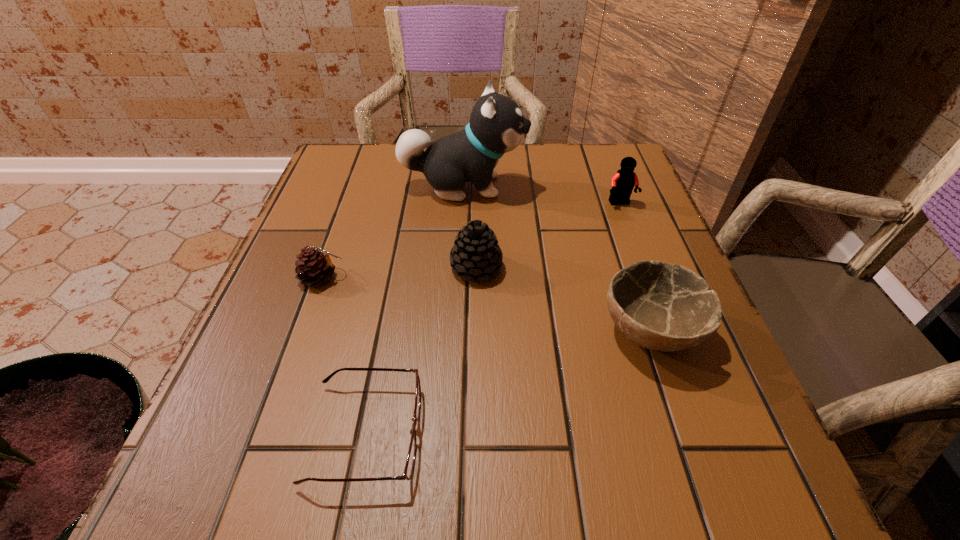
Identify the location of bowl that is positioned at the right edge. (659, 306).

Where is `object at the near left corner`? Image resolution: width=960 pixels, height=540 pixels. object at the near left corner is located at coordinates (410, 461).

This screenshot has width=960, height=540. In the image, there is a desktop. In order to click on vacant space at the near edge in this screenshot , I will do `click(581, 513)`.

In the image, there is a desktop. In order to click on vacant space at the left edge in this screenshot , I will do `click(324, 202)`.

Find the location of a particular element. The image size is (960, 540). free region at the right edge of the desktop is located at coordinates (728, 368).

Where is `free location at the far left corner`? free location at the far left corner is located at coordinates 365,185.

Where is `vacant space at the near right corner of the desktop`? The width and height of the screenshot is (960, 540). vacant space at the near right corner of the desktop is located at coordinates (706, 460).

Identify the location of empty location between the right pinecone and the nearest object. The width and height of the screenshot is (960, 540). (420, 350).

Find the location of a particular element. This screenshot has width=960, height=540. vacant space that is in between the puppy and the bowl is located at coordinates (557, 259).

At what (x,y) coordinates should I click in order to perform the action: click on free space between the leftmost object and the shortest object. Please return your answer as a coordinate pair (x, y). Looking at the image, I should click on (344, 356).